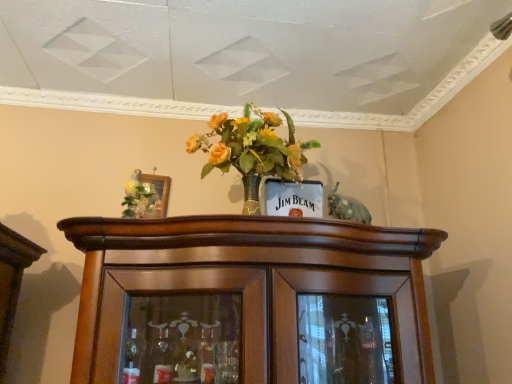
What is the approximate height of matte yellow flowers at upper center?

18.86 centimeters.

Image resolution: width=512 pixels, height=384 pixels. What do you see at coordinates (138, 197) in the screenshot? I see `matte yellow flowers at upper center` at bounding box center [138, 197].

The width and height of the screenshot is (512, 384). In order to click on matte yellow flowers at upper center in this screenshot , I will do [x=138, y=197].

You are a GUI agent. You are given a task and a screenshot of the screen. Output one action in this format:
    pyautogui.click(x=<x>, y=<y>)
    Task: Click on the matte yellow flowers at upper center
    
    Given the screenshot: What is the action you would take?
    pyautogui.click(x=138, y=197)